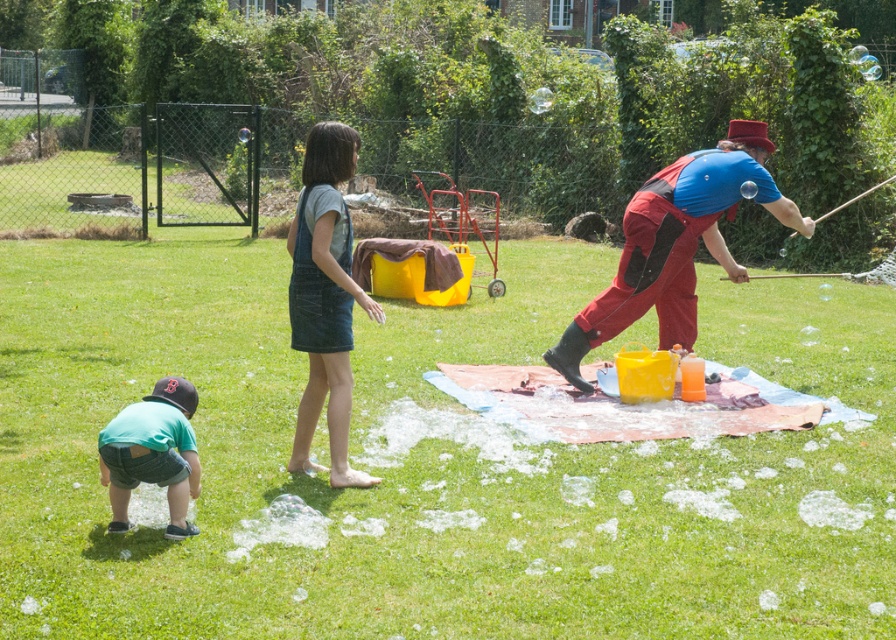
Question: Is matte red jumpsuit at right to the right of green denim shorts at lower left from the viewer's perspective?

Choices:
 (A) no
 (B) yes

Answer: (B)

Question: Can you confirm if matte red jumpsuit at right is positioned below denim overalls at center?

Choices:
 (A) no
 (B) yes

Answer: (A)

Question: Can you confirm if matte red jumpsuit at right is smaller than denim overalls at center?

Choices:
 (A) yes
 (B) no

Answer: (B)

Question: Which of the following is the closest to the observer?

Choices:
 (A) matte red jumpsuit at right
 (B) green denim shorts at lower left

Answer: (B)

Question: Among these points, which one is nearest to the camera?

Choices:
 (A) (610, 323)
 (B) (141, 444)
 (C) (332, 198)

Answer: (B)

Question: Among these objects, which one is farthest from the camera?

Choices:
 (A) matte red jumpsuit at right
 (B) denim overalls at center

Answer: (A)